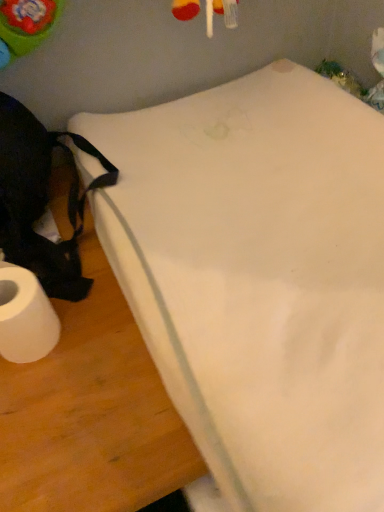
Describe the element at coordinates (259, 279) in the screenshot. I see `white foam mattress at lower left` at that location.

The height and width of the screenshot is (512, 384). Find the location of `white foam mattress at lower left`. white foam mattress at lower left is located at coordinates (259, 279).

The width and height of the screenshot is (384, 512). Describe the element at coordinates (25, 317) in the screenshot. I see `white matte toilet paper at lower left` at that location.

Where is `white matte toilet paper at lower left`? The height and width of the screenshot is (512, 384). white matte toilet paper at lower left is located at coordinates (25, 317).

Locate an element on the screen. white foam mattress at lower left is located at coordinates (259, 279).

Considering the relative positions of white foam mattress at lower left and white matte toilet paper at lower left in the image provided, is white foam mattress at lower left to the right of white matte toilet paper at lower left from the viewer's perspective?

Yes, white foam mattress at lower left is to the right of white matte toilet paper at lower left.

Relative to white matte toilet paper at lower left, is white foam mattress at lower left in front or behind?

Clearly, white foam mattress at lower left is in front of white matte toilet paper at lower left.

Is point (222, 492) closer or farther from the camera than point (47, 310)?

Point (222, 492) appears to be closer to the viewer than point (47, 310).

From the image's perspective, is white foam mattress at lower left located above or below white matte toilet paper at lower left?

From the image's perspective, white foam mattress at lower left appears above white matte toilet paper at lower left.

From a real-world perspective, which is physically above, white foam mattress at lower left or white matte toilet paper at lower left?

white foam mattress at lower left.

Looking at this image, considering the sizes of white foam mattress at lower left and white matte toilet paper at lower left in the image, is white foam mattress at lower left wider or thinner than white matte toilet paper at lower left?

Considering their sizes, white foam mattress at lower left looks broader than white matte toilet paper at lower left.

Considering the sizes of objects white foam mattress at lower left and white matte toilet paper at lower left in the image provided, who is shorter, white foam mattress at lower left or white matte toilet paper at lower left?

white matte toilet paper at lower left is shorter.

Does white foam mattress at lower left have a smaller size compared to white matte toilet paper at lower left?

No, white foam mattress at lower left is not smaller than white matte toilet paper at lower left.

Do you think white foam mattress at lower left is within white matte toilet paper at lower left, or outside of it?

white foam mattress at lower left lies outside white matte toilet paper at lower left.

Looking at this image, is white foam mattress at lower left not near white matte toilet paper at lower left?

No, white foam mattress at lower left is not far from white matte toilet paper at lower left.

Is white foam mattress at lower left oriented away from white matte toilet paper at lower left?

white foam mattress at lower left is not turned away from white matte toilet paper at lower left.

What's the angular difference between white foam mattress at lower left and white matte toilet paper at lower left's facing directions?

They differ by 0.786 degrees in their facing directions.

In the scene shown: Measure the distance between white foam mattress at lower left and white matte toilet paper at lower left.

The distance of white foam mattress at lower left from white matte toilet paper at lower left is 12.23 inches.

In the image, there is a white foam mattress at lower left. At what (x,y) coordinates should I click in order to perform the action: click on toilet paper below it (from a real-world perspective). Please return your answer as a coordinate pair (x, y). This screenshot has width=384, height=512. Looking at the image, I should click on (25, 317).

Is white matte toilet paper at lower left to the left or to the right of white foam mattress at lower left in the image?

white matte toilet paper at lower left is positioned on white foam mattress at lower left's left side.

Which object is closer to the camera, white matte toilet paper at lower left or white foam mattress at lower left?

white foam mattress at lower left is closer to the camera.

Which is farther from the camera, (x=47, y=324) or (x=265, y=298)?

The point (x=47, y=324) is behind.

From the image's perspective, who appears lower, white matte toilet paper at lower left or white foam mattress at lower left?

white matte toilet paper at lower left.

From a real-world perspective, between white matte toilet paper at lower left and white foam mattress at lower left, who is vertically higher?

white foam mattress at lower left is physically above.

Which of these two, white matte toilet paper at lower left or white foam mattress at lower left, is thinner?

white matte toilet paper at lower left is thinner.

Who is taller, white matte toilet paper at lower left or white foam mattress at lower left?

white foam mattress at lower left is taller.

Which of these two, white matte toilet paper at lower left or white foam mattress at lower left, is bigger?

With larger size is white foam mattress at lower left.

Is white matte toilet paper at lower left completely or partially outside of white foam mattress at lower left?

white matte toilet paper at lower left is positioned outside white foam mattress at lower left.

Would you say white matte toilet paper at lower left is a long distance from white foam mattress at lower left?

No, there isn't a large distance between white matte toilet paper at lower left and white foam mattress at lower left.

Is white matte toilet paper at lower left looking in the opposite direction of white foam mattress at lower left?

No.

How many degrees apart are the facing directions of white matte toilet paper at lower left and white foam mattress at lower left?

0.786 degrees.

How much distance is there between white matte toilet paper at lower left and white foam mattress at lower left?

white matte toilet paper at lower left and white foam mattress at lower left are 12.23 inches apart.

At what (x,y) coordinates should I click in order to perform the action: click on toilet paper that appears below the white foam mattress at lower left (from the image's perspective). Please return your answer as a coordinate pair (x, y). The height and width of the screenshot is (512, 384). Looking at the image, I should click on (25, 317).

I want to click on toilet paper on the left of white foam mattress at lower left, so click(25, 317).

The image size is (384, 512). What are the coordinates of `toilet paper located underneath the white foam mattress at lower left (from a real-world perspective)` in the screenshot? It's located at (25, 317).